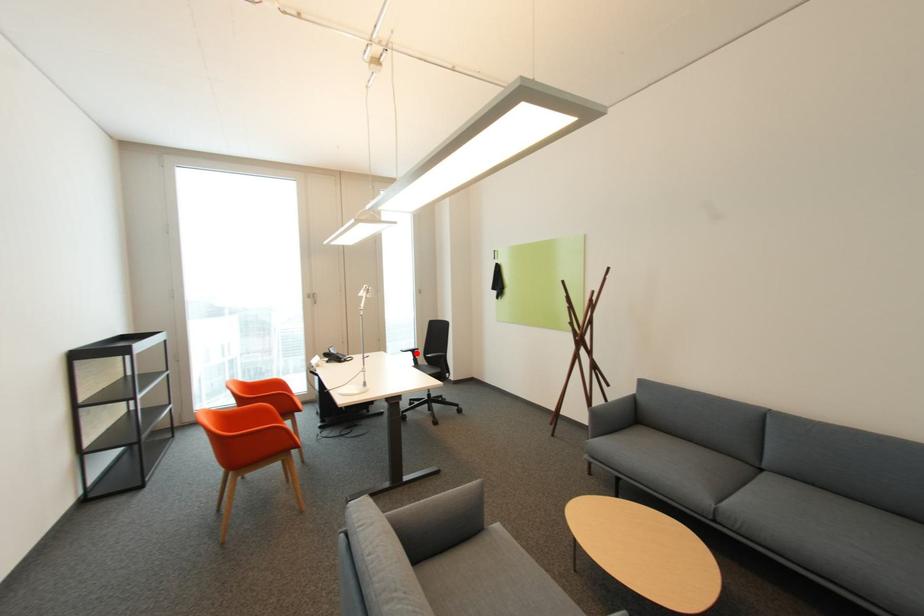
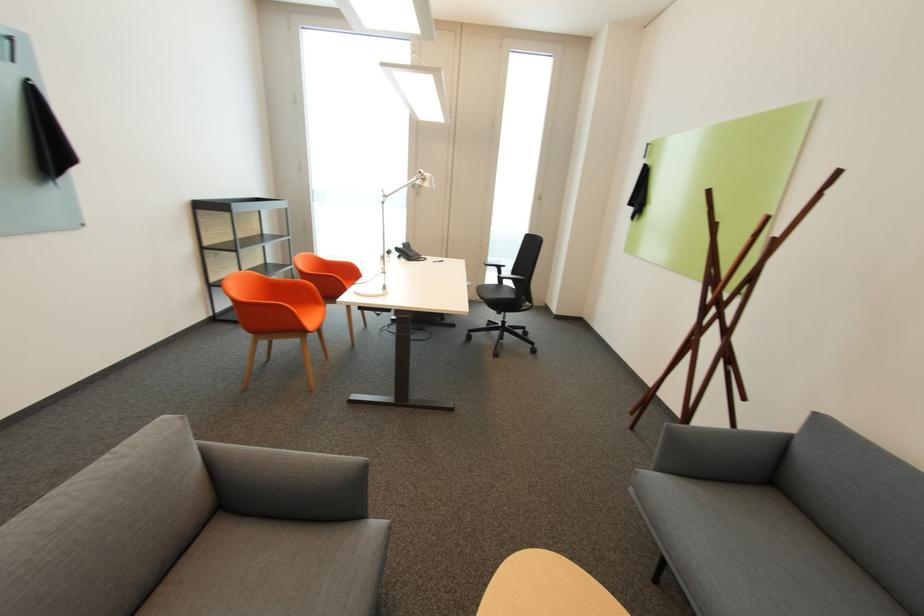
Question: I am providing you with two images of the same scene from different viewpoints. Given a red point in image1, look at the same physical point in image2. Is it:

Choices:
 (A) Closer to the viewpoint
 (B) Farther from the viewpoint

Answer: (A)